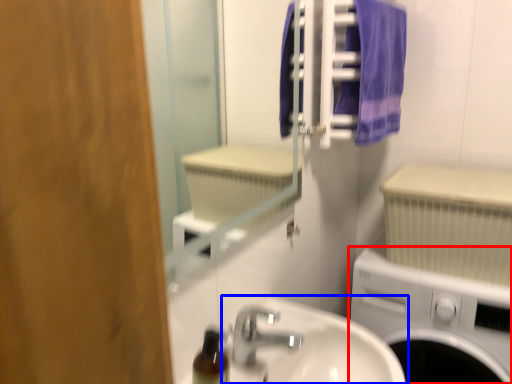
Question: Among these objects, which one is farthest to the camera, washing machine (highlighted by a red box) or sink (highlighted by a blue box)?

Choices:
 (A) washing machine
 (B) sink

Answer: (A)